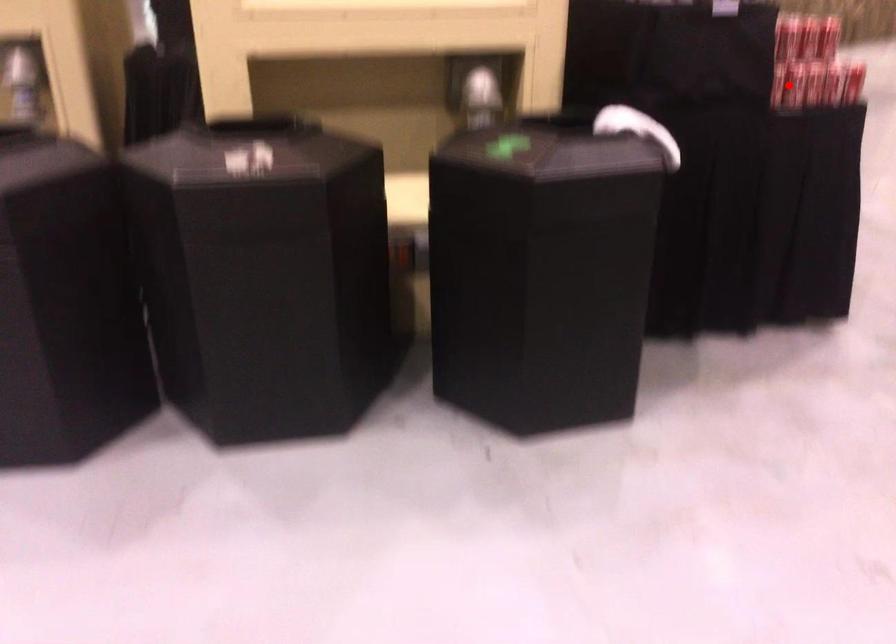
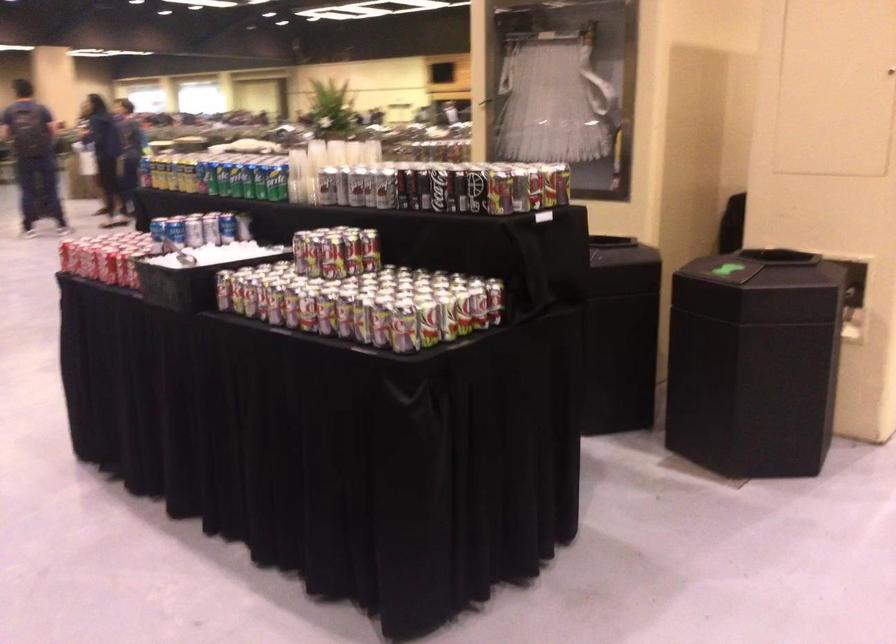
Question: I am providing you with two images of the same scene from different viewpoints. A red point is marked on the first image. At the location where the point appears in image 1, is it still visible in image 2?

Choices:
 (A) Yes
 (B) No

Answer: (B)